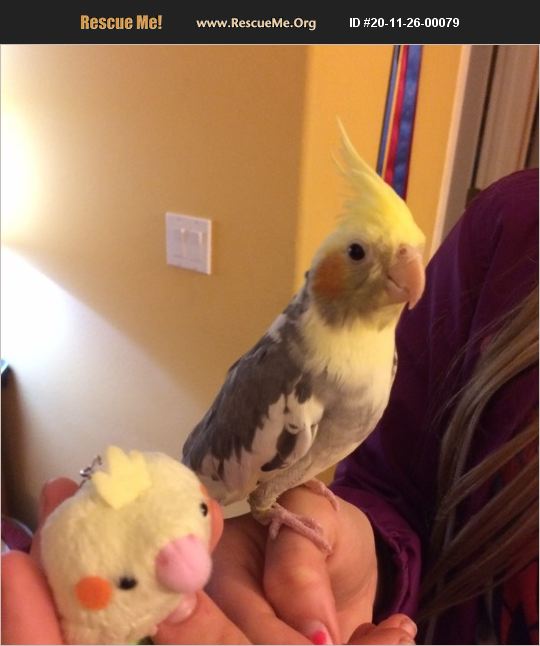
This screenshot has height=646, width=540. In order to click on lamp in this screenshot , I will do [40, 344].